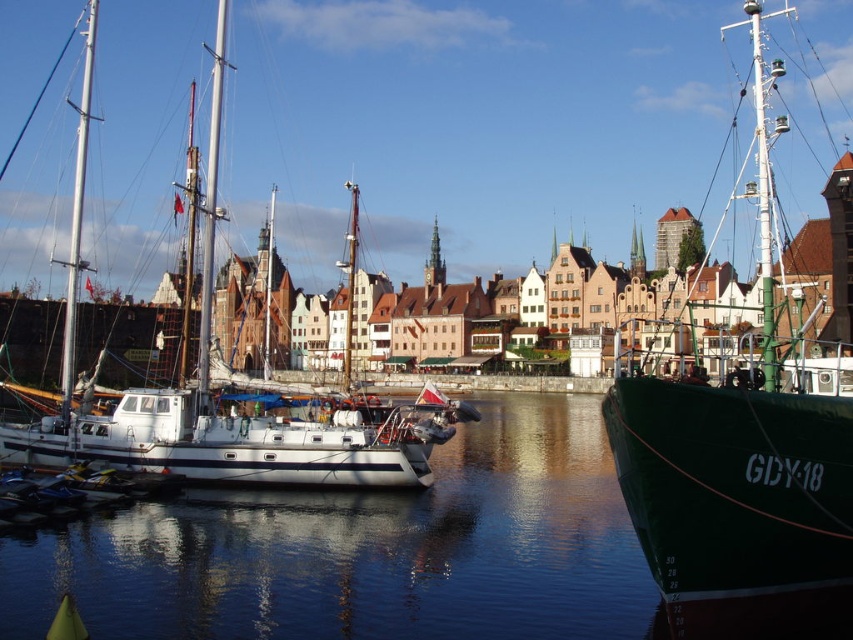
Between clear water at center and green matte ship at right, which one is positioned higher?

green matte ship at right

Does clear water at center have a greater width compared to green matte ship at right?

In fact, clear water at center might be narrower than green matte ship at right.

Which is in front, point (283, 628) or point (709, 563)?

Positioned in front is point (709, 563).

Locate an element on the screen. This screenshot has height=640, width=853. clear water at center is located at coordinates (368, 550).

Can you confirm if green matte ship at right is thinner than white matte sailboat at left?

Correct, green matte ship at right's width is less than white matte sailboat at left's.

Is point (610, 436) closer to camera compared to point (317, 419)?

Yes, it is.

Where is `green matte ship at right`? green matte ship at right is located at coordinates tap(740, 474).

Is clear water at center thinner than white matte sailboat at left?

Indeed, clear water at center has a lesser width compared to white matte sailboat at left.

This screenshot has width=853, height=640. I want to click on clear water at center, so click(x=368, y=550).

Does point (614, 548) come behind point (370, 476)?

No.

Identify the location of clear water at center. (368, 550).